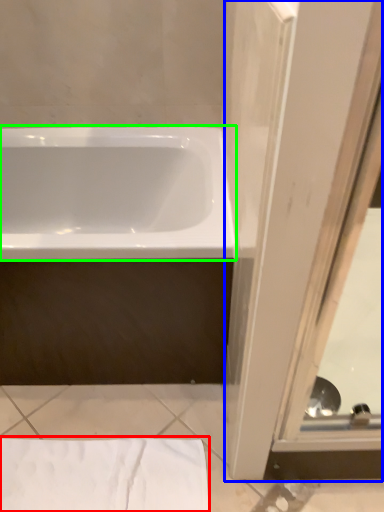
Question: Which object is positioned closest to sheet (highlighted by a red box)? Select from screen door (highlighted by a blue box) and bathtub (highlighted by a green box).

Choices:
 (A) screen door
 (B) bathtub

Answer: (A)